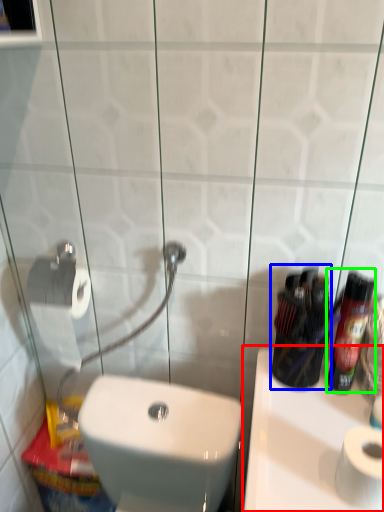
Question: Which is farther away from sink (highlighted by a red box)? mouthwash (highlighted by a blue box) or cleaning product (highlighted by a green box)?

Choices:
 (A) mouthwash
 (B) cleaning product

Answer: (B)